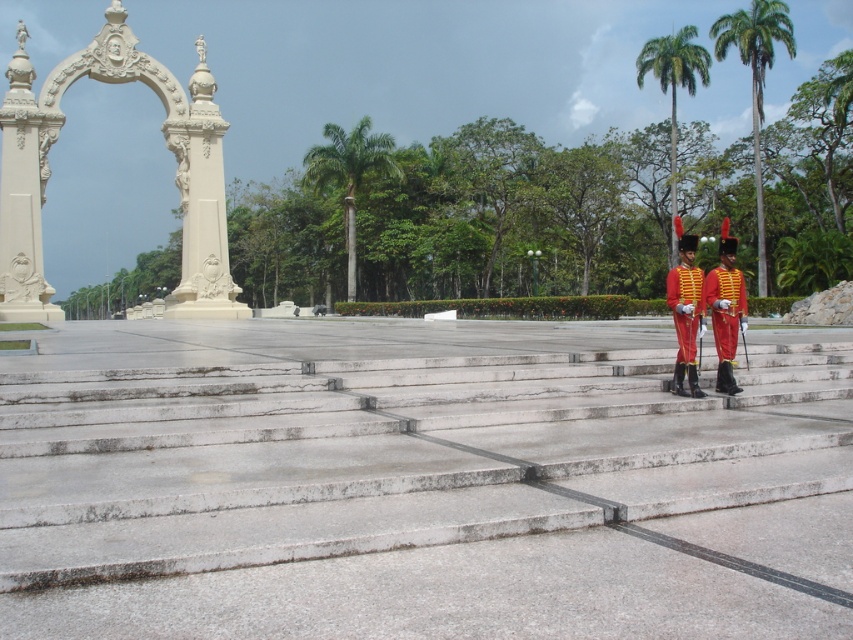
Question: Can you confirm if green leafy palm tree at center is bigger than red velvet uniform at right?

Choices:
 (A) yes
 (B) no

Answer: (A)

Question: Which point is closer to the camera taking this photo?

Choices:
 (A) (368, 129)
 (B) (711, 273)
 (C) (380, 467)
 (D) (685, 337)

Answer: (C)

Question: Where is smooth concrete stairs at center located in relation to green leafy palm tree at upper right in the image?

Choices:
 (A) above
 (B) below

Answer: (B)

Question: Among these objects, which one is farthest from the camera?

Choices:
 (A) red velvet uniform at right
 (B) green leafy palm tree at center
 (C) white stone arch at upper left
 (D) shiny red fabric uniform at center

Answer: (B)

Question: Observing the image, what is the correct spatial positioning of smooth concrete stairs at center in reference to green leafy palm tree at upper right?

Choices:
 (A) below
 (B) above

Answer: (A)

Question: Among these objects, which one is nearest to the camera?

Choices:
 (A) shiny red fabric uniform at center
 (B) green leafy palm tree at right

Answer: (A)